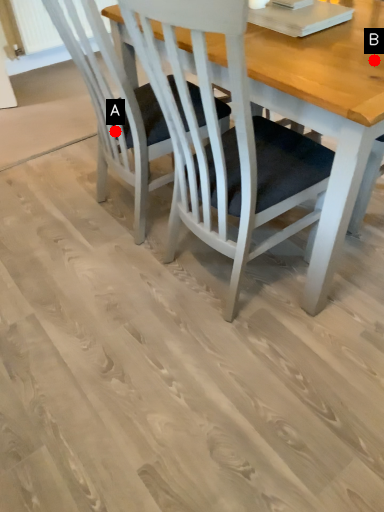
Question: Two points are circled on the image, labeled by A and B beside each circle. Which point is farther from the camera taking this photo?

Choices:
 (A) A is further
 (B) B is further

Answer: (A)